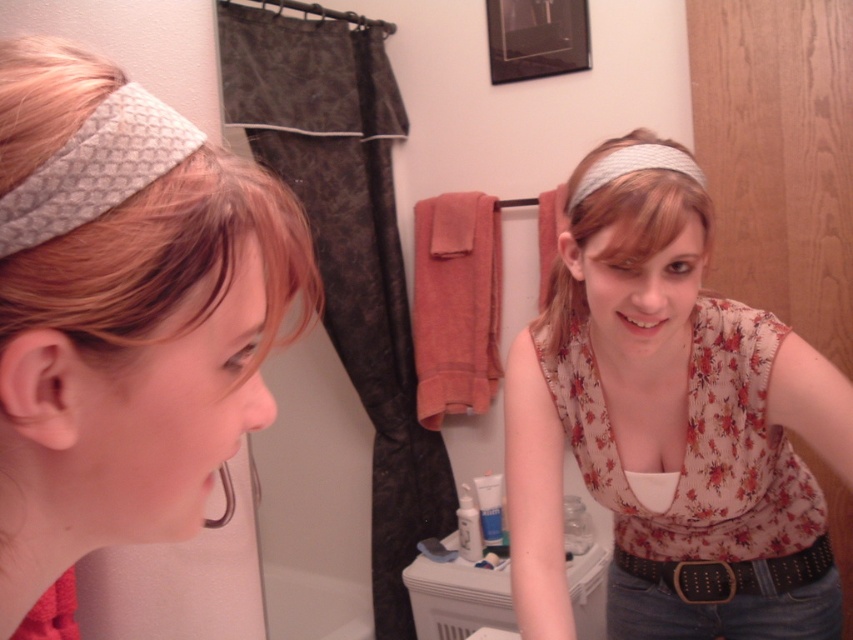
Question: Based on their relative distances, which object is nearer to the white textured headband at center?

Choices:
 (A) matte gray headband at upper left
 (B) floral fabric top at center

Answer: (B)

Question: Can you confirm if matte gray headband at upper left is bigger than black leather belt at lower right?

Choices:
 (A) no
 (B) yes

Answer: (B)

Question: Among these points, which one is farthest from the camera?

Choices:
 (A) (71, 451)
 (B) (706, 582)
 (C) (554, 342)
 (D) (815, 536)

Answer: (B)

Question: Is floral fabric top at center thinner than black leather belt at lower right?

Choices:
 (A) yes
 (B) no

Answer: (B)

Question: Is the position of white textured headband at center more distant than that of black leather belt at lower right?

Choices:
 (A) yes
 (B) no

Answer: (B)

Question: Which of the following is the farthest from the observer?

Choices:
 (A) white textured headband at center
 (B) black leather belt at lower right

Answer: (B)